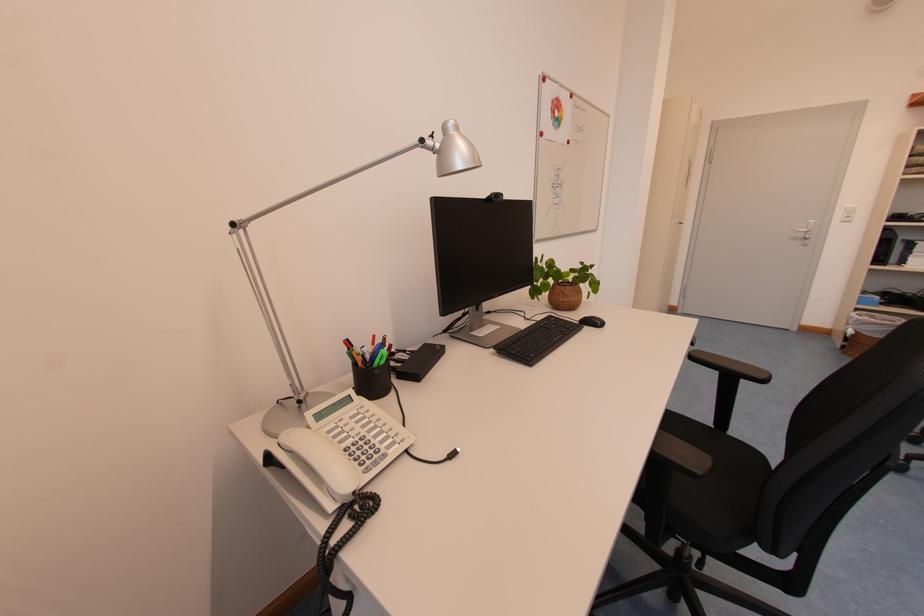
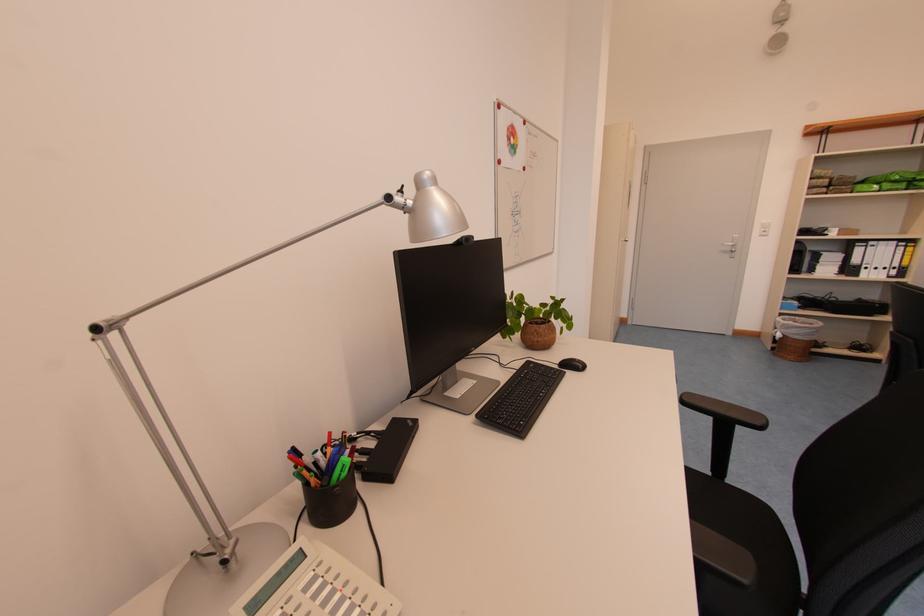
Locate, in the second image, the point that corresponds to (374,359) in the first image.

(331, 466)